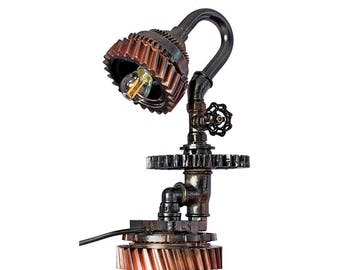
Locate an element on the screen. The height and width of the screenshot is (270, 340). handle is located at coordinates (95, 238).